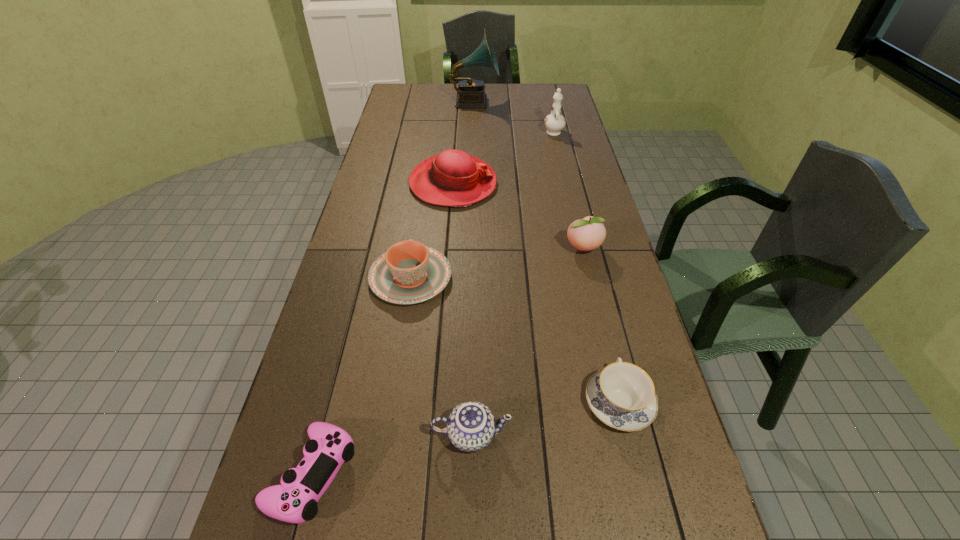
Locate an element on the screen. chinaware that is the third nearest to the seventh shortest object is located at coordinates (471, 426).

This screenshot has width=960, height=540. I want to click on blank area in the image that satisfies the following two spatial constraints: 1. on the handle side of the peach; 2. on the left side of the third nearest chinaware, so click(415, 249).

Identify the location of vacant point that satisfies the following two spatial constraints: 1. on the back side of the peach; 2. from the horn of the tallest object. The image size is (960, 540). (547, 102).

This screenshot has width=960, height=540. I want to click on free location that satisfies the following two spatial constraints: 1. with the handle on the side of the shortest chinaware; 2. from the horn of the farthest object, so coord(547,102).